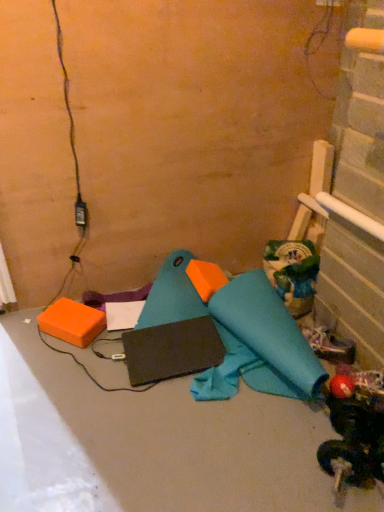
Identify the location of blank space above black matte laptop at center (from a real-world perspective). (180, 345).